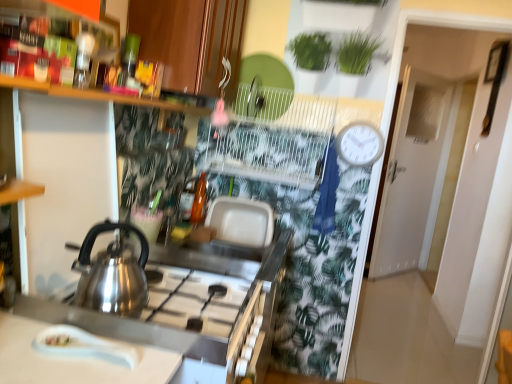
Question: Is white matte door at upper right wider or thinner than white plastic clock at upper right?

Choices:
 (A) thin
 (B) wide

Answer: (B)

Question: In the image, is white matte door at upper right on the left side or the right side of white plastic clock at upper right?

Choices:
 (A) right
 (B) left

Answer: (A)

Question: Estimate the real-world distances between objects in this image. Which object is farther from the translucent glass bottle at center, marked as the second bottle in a back-to-front arrangement?

Choices:
 (A) white glossy spoon at lower left
 (B) wooden cabinet at upper center
 (C) satin silver kettle at stove front
 (D) translucent glass bottle at center, the second bottle in the front-to-back sequence
 (E) wooden shelf at upper left

Answer: (A)

Question: Estimate the real-world distances between objects in this image. Which object is closer to the white plastic clock at upper right?

Choices:
 (A) wooden cabinet at upper center
 (B) translucent glass bottle at center, the 1th bottle in the front-to-back sequence
 (C) satin silver kettle at stove front
 (D) wooden shelf at upper left
 (E) white glossy spoon at lower left

Answer: (B)